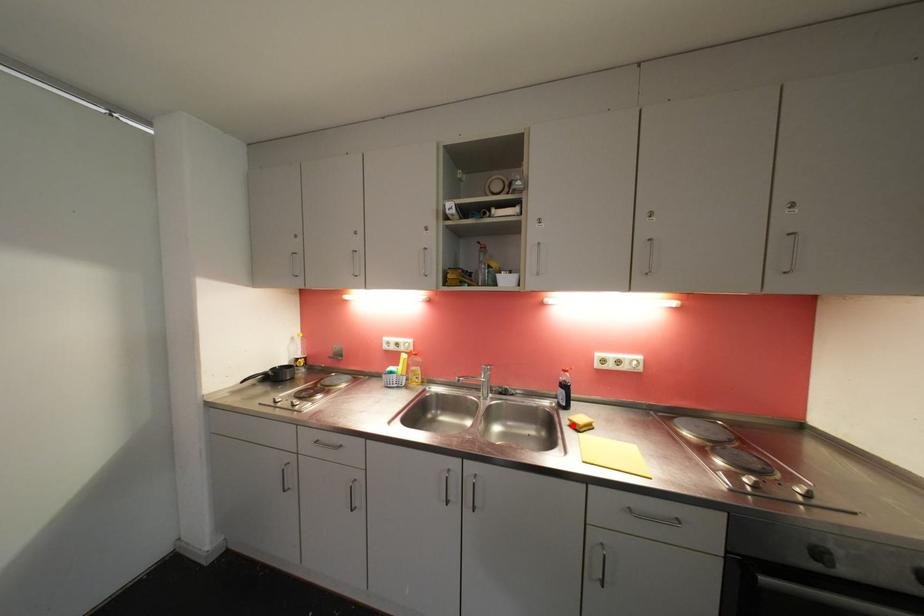
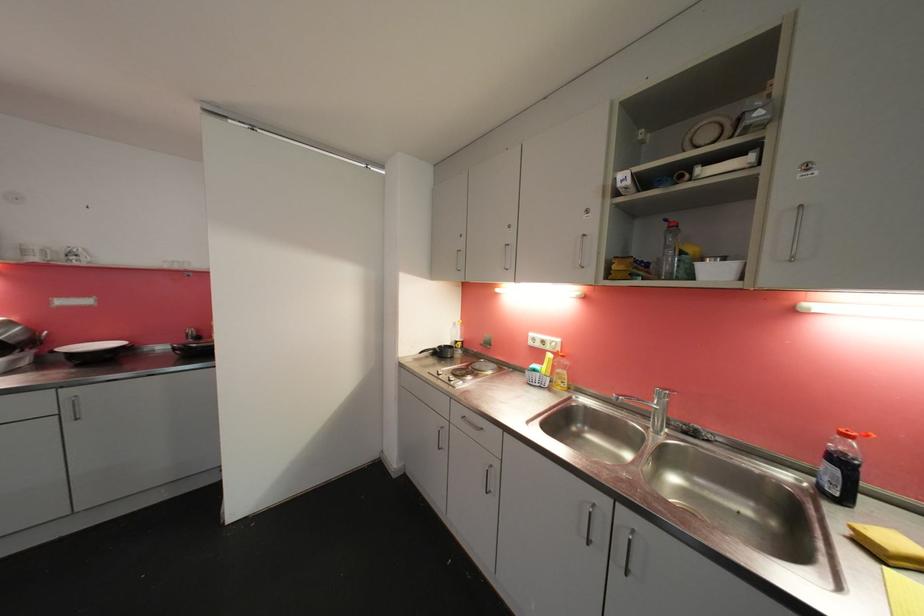
The point at the highlighted location is marked in the first image. Where is the corresponding point in the second image?

(853, 533)